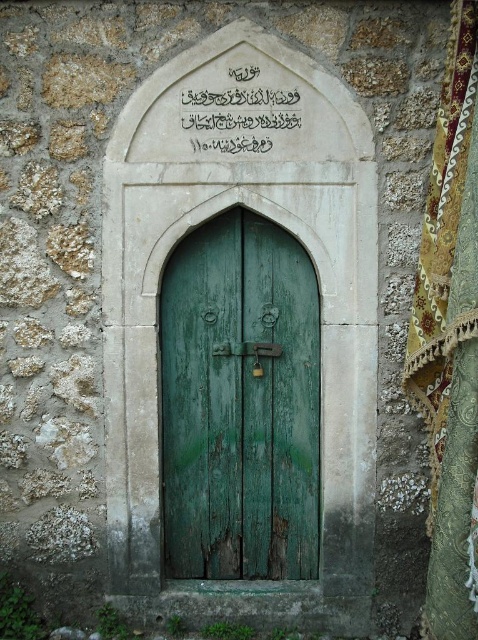
Question: Is green wooden door at center behind black stone writing at center?

Choices:
 (A) no
 (B) yes

Answer: (B)

Question: Which object is closer to the camera taking this photo?

Choices:
 (A) green wooden door at center
 (B) black stone writing at center

Answer: (B)

Question: From the image, what is the correct spatial relationship of green wooden door at center in relation to black stone writing at center?

Choices:
 (A) below
 (B) above

Answer: (A)

Question: From the image, what is the correct spatial relationship of green wooden door at center in relation to black stone writing at center?

Choices:
 (A) left
 (B) right

Answer: (A)

Question: Among these objects, which one is nearest to the camera?

Choices:
 (A) green wooden door at center
 (B) black stone writing at center

Answer: (B)